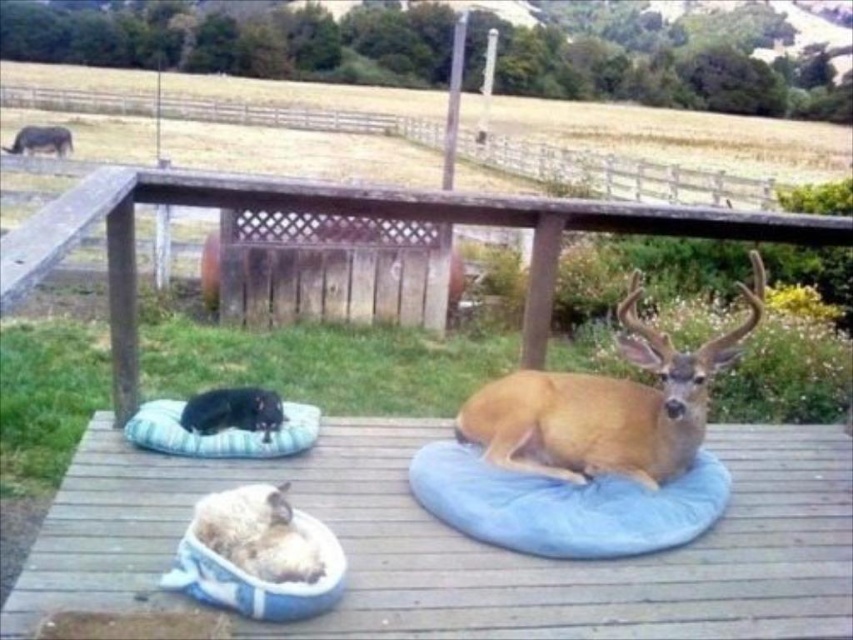
Question: Which object is closer to the camera taking this photo?

Choices:
 (A) golden brown fur at center
 (B) blue fabric dog bed at lower left
 (C) black fur cat at lower left
 (D) blue plush dog bed at center

Answer: (D)

Question: Does wooden deck at center come in front of blue plush dog bed at center?

Choices:
 (A) no
 (B) yes

Answer: (B)

Question: In this image, where is fluffy white dog bed at lower center located relative to black fur cat at lower left?

Choices:
 (A) above
 (B) below

Answer: (B)

Question: Considering the relative positions of wooden deck at center and golden brown fur at center in the image provided, where is wooden deck at center located with respect to golden brown fur at center?

Choices:
 (A) above
 (B) below

Answer: (B)

Question: Which point is farther from the camera taking this photo?

Choices:
 (A) (426, 540)
 (B) (294, 525)
 (C) (263, 560)
 (D) (634, 412)

Answer: (D)

Question: Which of the following is the closest to the observer?

Choices:
 (A) blue fabric dog bed at lower left
 (B) fuzzy white cat at lower center
 (C) golden brown fur at center
 (D) blue plush dog bed at center

Answer: (B)